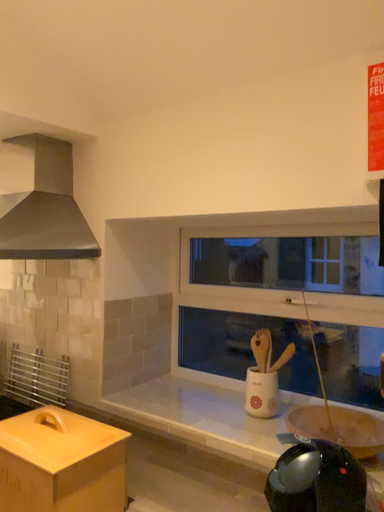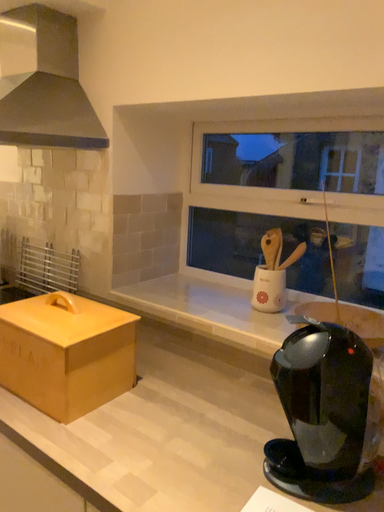
Question: Which way did the camera rotate in the video?

Choices:
 (A) rotated downward
 (B) rotated upward

Answer: (A)